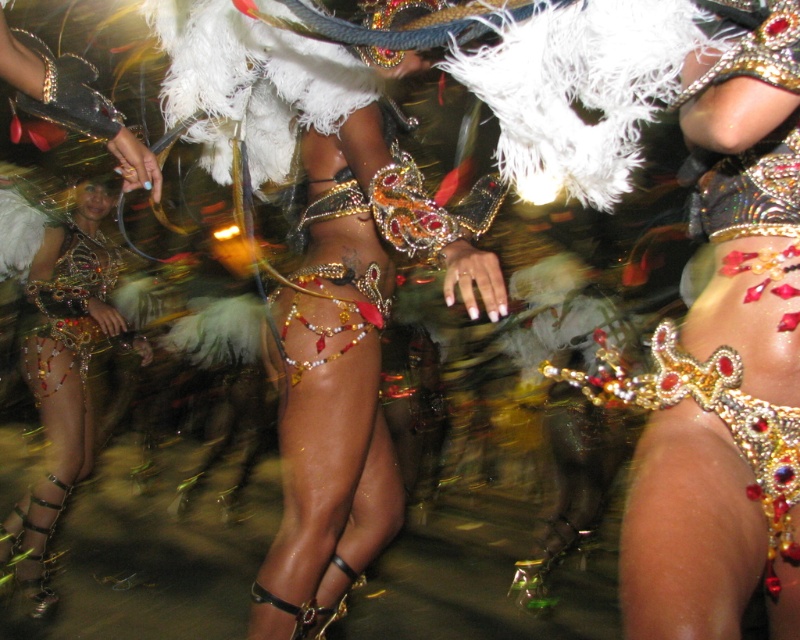
Measure the distance between shiny gold bikini at center and metallic gold bikini at center.

shiny gold bikini at center and metallic gold bikini at center are 1.32 meters apart from each other.

Can you confirm if shiny gold bikini at center is wider than metallic gold bikini at center?

Yes, shiny gold bikini at center is wider than metallic gold bikini at center.

At what (x,y) coordinates should I click in order to perform the action: click on shiny gold bikini at center. Please return your answer as a coordinate pair (x, y). Looking at the image, I should click on (322, 280).